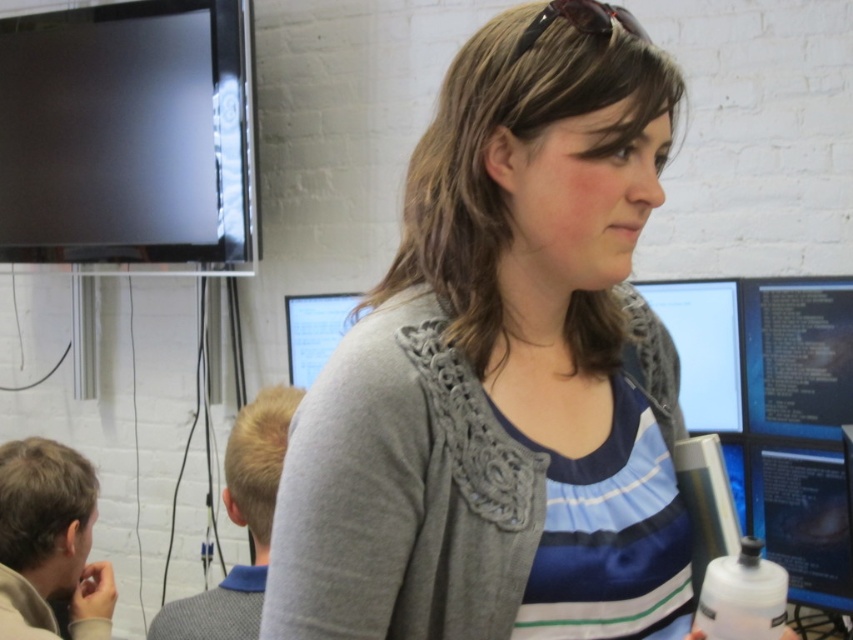
You are setting up a new monitor stand that requires the tallest monitor to be placed at the back. Given the black glossy monitor at upper left and the matte plastic monitor at center, which one should you place at the back?

The black glossy monitor at upper left has a greater height compared to the matte plastic monitor at center, so you should place the black glossy monitor at upper left at the back.

From the picture: You are standing in the office scene described. You notice two points marked on the wall. The first point is at coordinates point (137, 211) and the second point is at point (80, 524). From your perspective, which point is closer to you?

Point (80, 524) is closer to you because the description states that point (137, 211) is behind point (80, 524).

You are an office assistant who needs to adjust the position of the gray knitted cardigan at center and the matte black monitor at center. According to the current setup, which object is located higher in the image?

The gray knitted cardigan at center is above the matte black monitor at center, so the gray knitted cardigan at center is higher in the image.